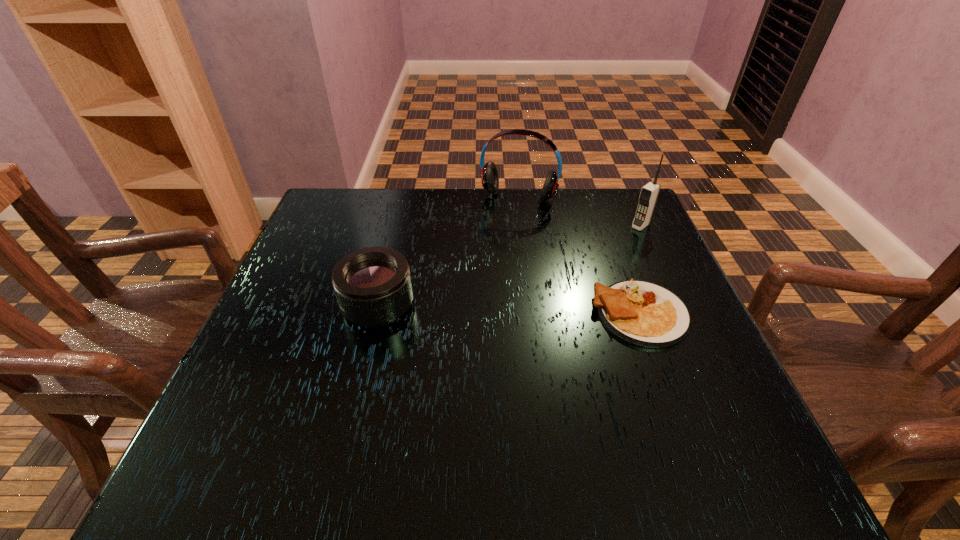
At what (x,y) coordinates should I click in order to perform the action: click on vacant spot on the desktop that is between the second shortest object and the shortest object and is positioned with the microphone attached to the side of the headset. Please return your answer as a coordinate pair (x, y). Image resolution: width=960 pixels, height=540 pixels. Looking at the image, I should click on (480, 309).

Find the location of `vacant space on the desktop that is between the leftmost object and the shortest object and is positioned on the front-facing side of the cellular telephone`. vacant space on the desktop that is between the leftmost object and the shortest object and is positioned on the front-facing side of the cellular telephone is located at coordinates (535, 310).